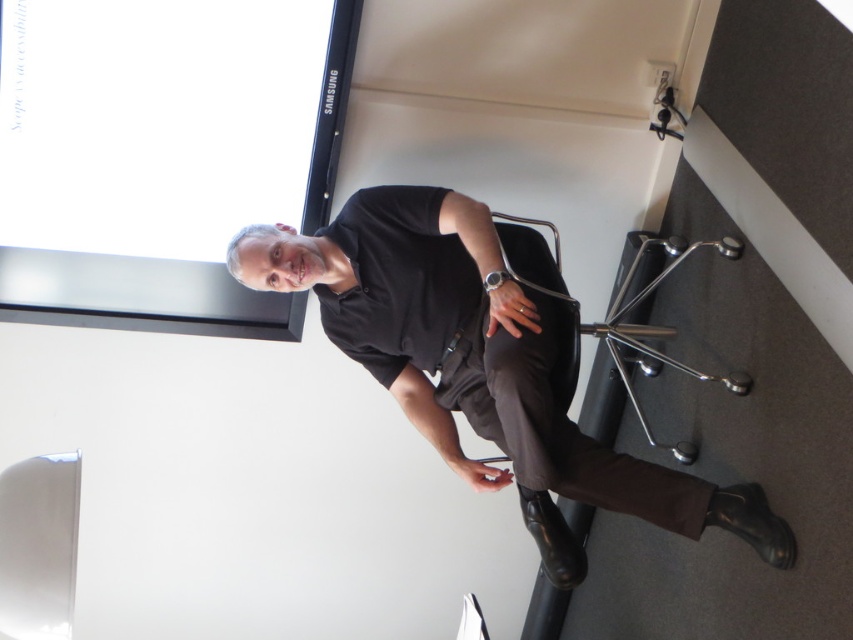
You are a delivery person who needs to place a 1.5 meter long package between the matte black screen at upper center and the metallic silver swivel chair at lower right. Is there enough space to fit the package horizontally between them?

The distance between the matte black screen at upper center and the metallic silver swivel chair at lower right is 1.42 meters. Since the package is 1.5 meters long, it is slightly longer than the available space. Therefore, the package cannot be placed horizontally between them without overlapping or requiring adjustment.

You are standing in the room and want to look at the matte black screen at upper center. Where should you look?

You should look at the point at coordinates (161, 154) to see the matte black screen at upper center.

You are taking a photo of the scene and want to focus on both point [283,266] and point [723,236]. Which point is closer to your camera lens?

Point [283,266] is closer to the camera lens than point [723,236].